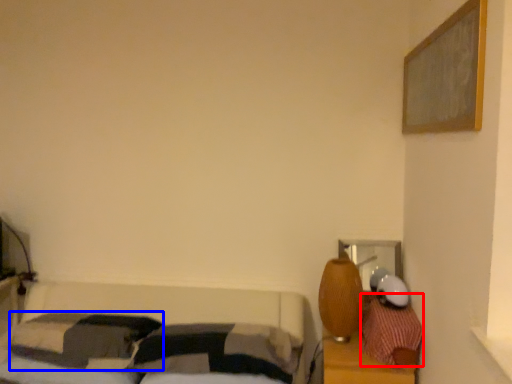
Question: Which object is closer to the camera taking this photo, pillow (highlighted by a red box) or pillow (highlighted by a blue box)?

Choices:
 (A) pillow
 (B) pillow

Answer: (A)